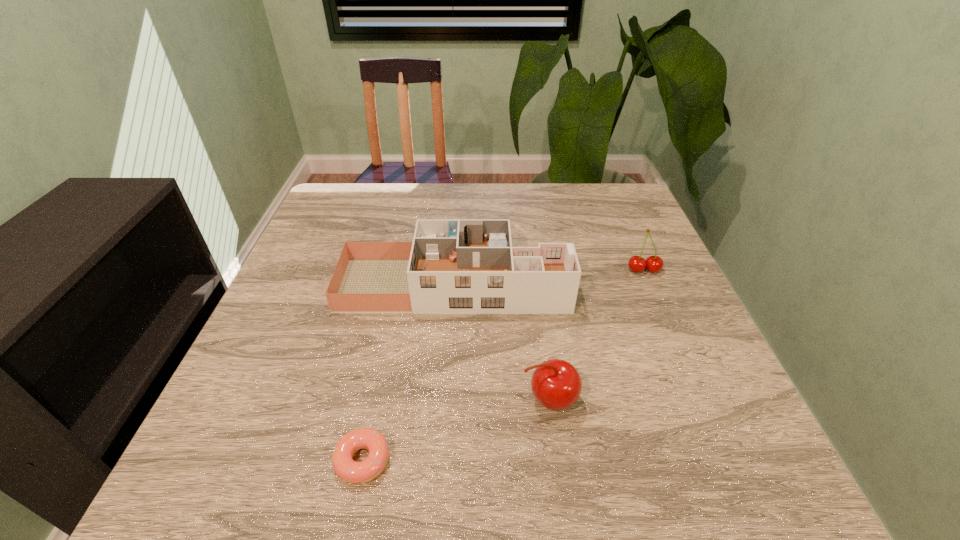
I want to click on free space that satisfies the following two spatial constraints: 1. with the stems of the rightmost object pointing upwards; 2. at the front door of the dollhouse, so click(650, 285).

This screenshot has height=540, width=960. Identify the location of vacant area in the image that satisfies the following two spatial constraints: 1. at the front door of the dollhouse; 2. on the right side of the nearer cherry. (x=446, y=400).

Find the location of a particular element. The height and width of the screenshot is (540, 960). free space that satisfies the following two spatial constraints: 1. at the front door of the left cherry; 2. on the left side of the dollhouse is located at coordinates (446, 400).

Image resolution: width=960 pixels, height=540 pixels. In order to click on free space that satisfies the following two spatial constraints: 1. on the back side of the nearer cherry; 2. on the right side of the doughnut in this screenshot , I will do `click(375, 400)`.

Image resolution: width=960 pixels, height=540 pixels. I want to click on free region that satisfies the following two spatial constraints: 1. with the stems of the rightmost object pointing upwards; 2. at the front door of the dollhouse, so click(650, 285).